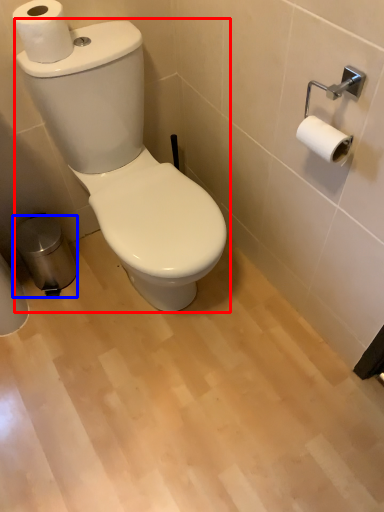
Question: Which of the following is the closest to the observer, toilet (highlighted by a red box) or trash bin/can (highlighted by a blue box)?

Choices:
 (A) toilet
 (B) trash bin/can

Answer: (A)